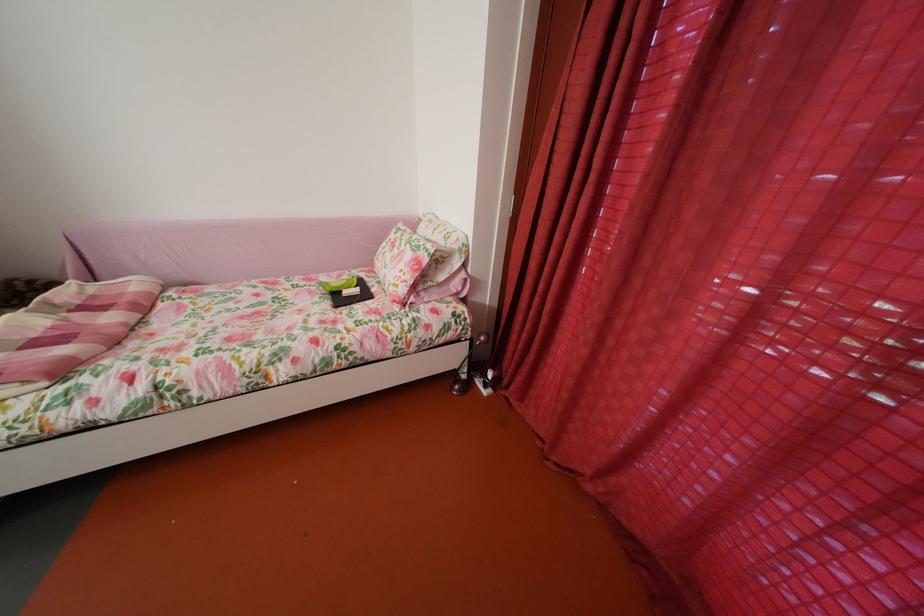
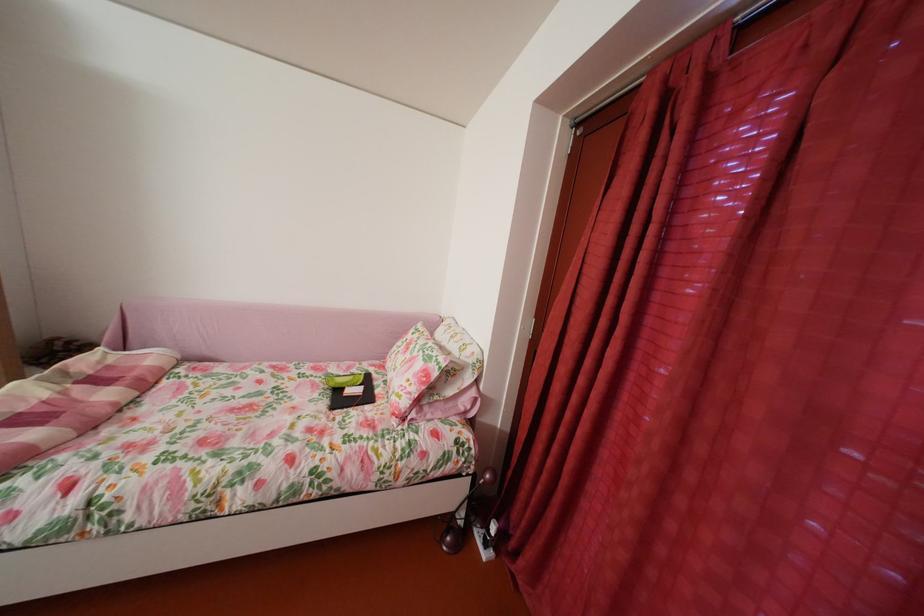
Question: The images are taken continuously from a first-person perspective. In which direction is your viewpoint rotating?

Choices:
 (A) Left
 (B) Right
 (C) Up
 (D) Down

Answer: (C)